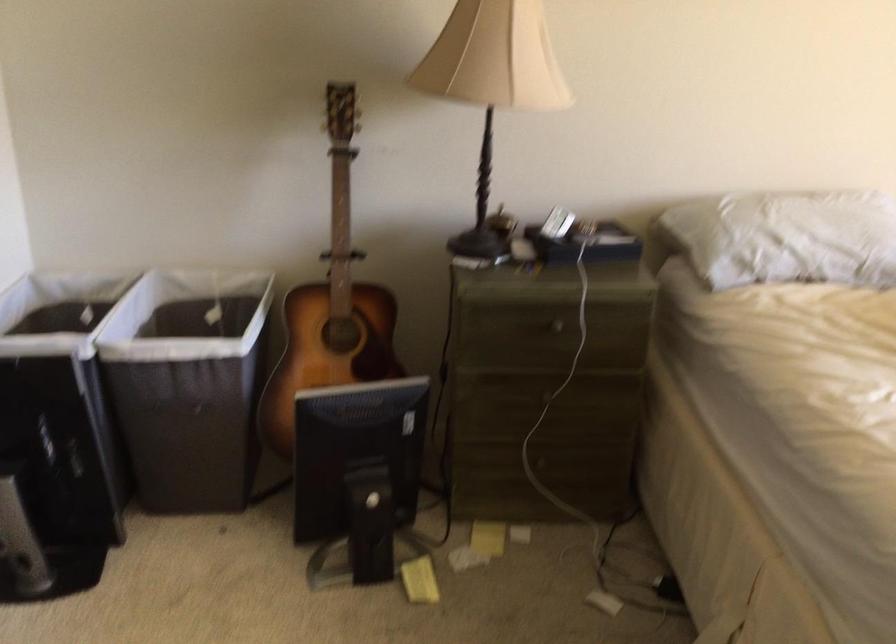
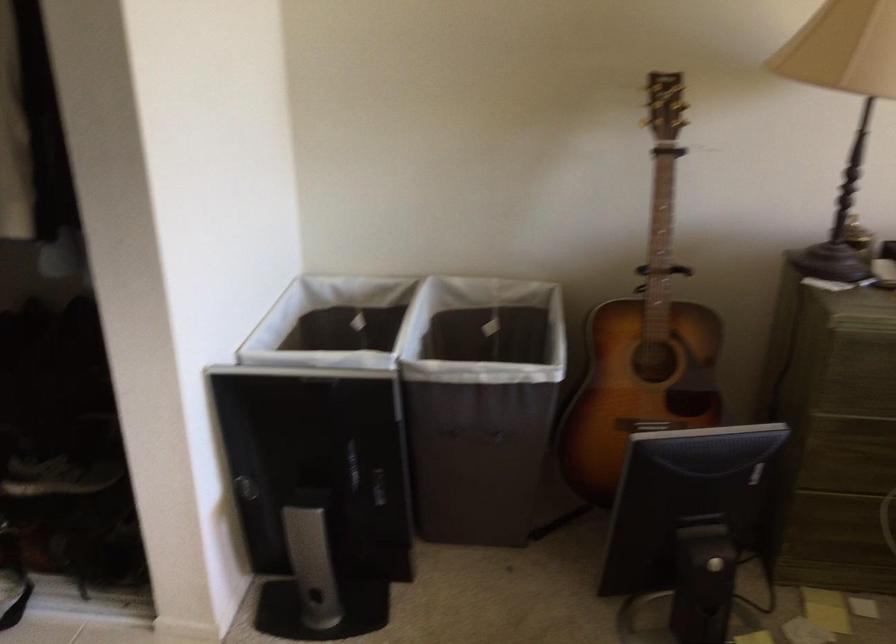
Question: The first image is from the beginning of the video and the second image is from the end. How did the camera likely rotate when shooting the video?

Choices:
 (A) Left
 (B) Right
 (C) Up
 (D) Down

Answer: (A)